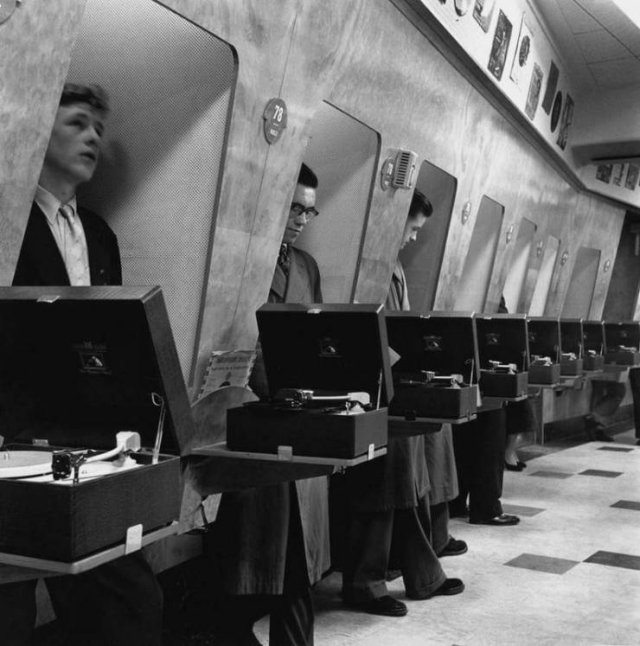
The height and width of the screenshot is (646, 640). In order to click on speaker in this screenshot , I will do `click(402, 165)`.